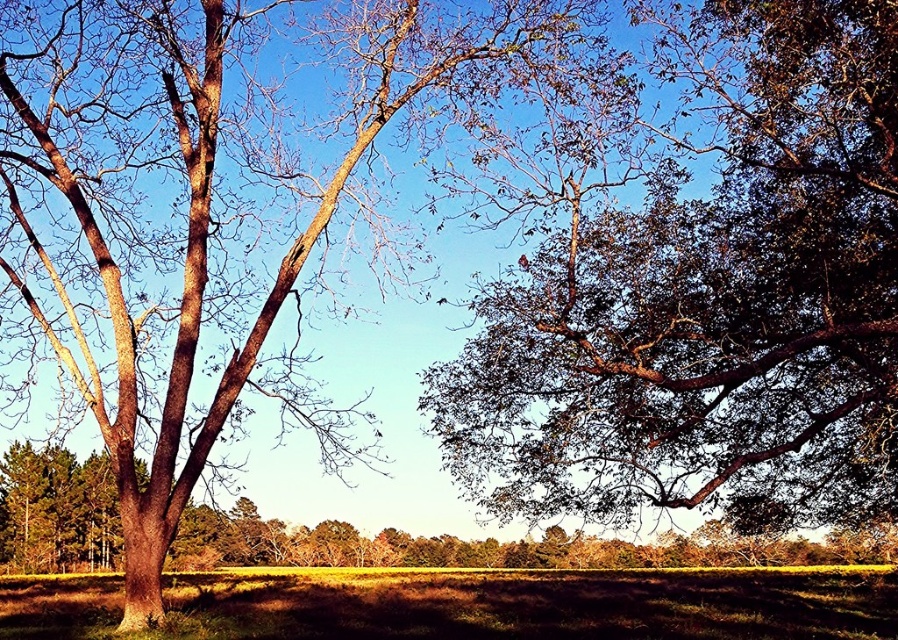
You are standing in the middle of the field and want to take a photo of the green leafy tree at upper right. Based on its coordinates, in which direction should you move to center the tree in your camera view?

The green leafy tree at upper right is located at coordinates point [709,300]. Since you are in the middle of the field, you should move towards the upper right direction to center the tree in your camera view.

You are a photographer standing at the camera position. You want to take a closeup photo of the smooth brown oak tree at upper right. How many steps do you need to take towards it to get a closer shot?

The smooth brown oak tree at upper right is 36.48 feet away from the camera. To get a closer shot, you would need to move forward approximately 36.48 feet, which is roughly 24 steps, assuming an average step length of 1.5 feet.